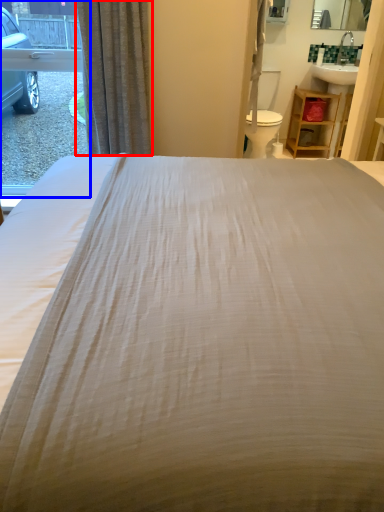
Question: Among these objects, which one is farthest to the camera, curtain (highlighted by a red box) or window (highlighted by a blue box)?

Choices:
 (A) curtain
 (B) window

Answer: (B)